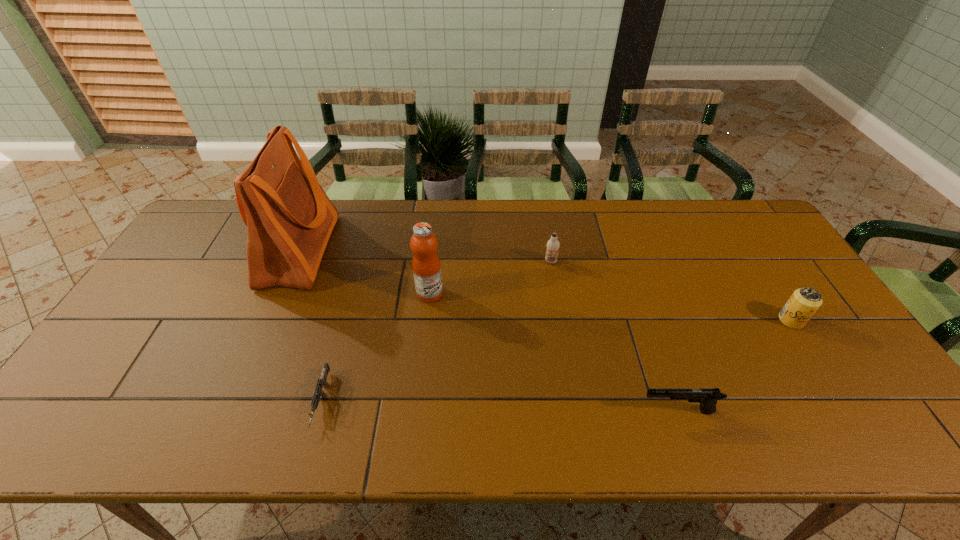
Identify the location of free space that satisfies the following two spatial constraints: 1. on the front pocket of the third object from right to left; 2. on the right side of the shopping bag. (295, 261).

Locate an element on the screen. This screenshot has height=540, width=960. free space that satisfies the following two spatial constraints: 1. on the back side of the beer can; 2. on the front label of the fruit juice is located at coordinates (774, 293).

I want to click on free spot that satisfies the following two spatial constraints: 1. on the front pocket of the leftmost object; 2. on the right side of the beer can, so click(270, 320).